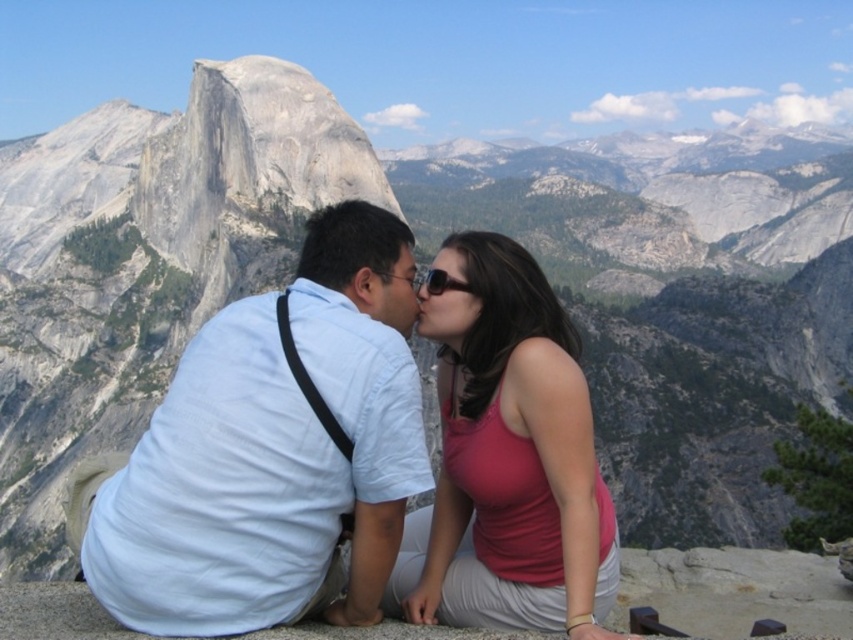
You are a photographer trying to capture the couple in the scene. You notice the matte pink tank top at center and the matte black hair at center. Which object should you focus on if you want to highlight the larger one in your photo?

The matte pink tank top at center is larger in size than the matte black hair at center, so you should focus on the matte pink tank top at center to highlight the larger one in your photo.

You are a photographer positioned at the center of the scene. You want to capture a closeup shot of both the light blue cotton shirt at center and the matte pink tank top at center in a single frame. Given that your camera has a maximum focus range of 8 meters, will you be able to achieve this?

The light blue cotton shirt at center is 9.27 meters away from the matte pink tank top at center. Since the maximum focus range of the camera is 8 meters, the distance between them exceeds this limit. Therefore, you cannot capture both in focus simultaneously in a single frame.

From the picture: You are a photographer trying to capture the couple in the scene. You need to ensure that the light blue cotton shirt at center and the matte black hair at center are both visible in the frame. Given their sizes, which object should you focus on to ensure both are in focus?

The light blue cotton shirt at center is bigger than matte black hair at center, so focusing on the light blue cotton shirt at center will help ensure both objects are in focus since it is larger and easier to capture clearly.